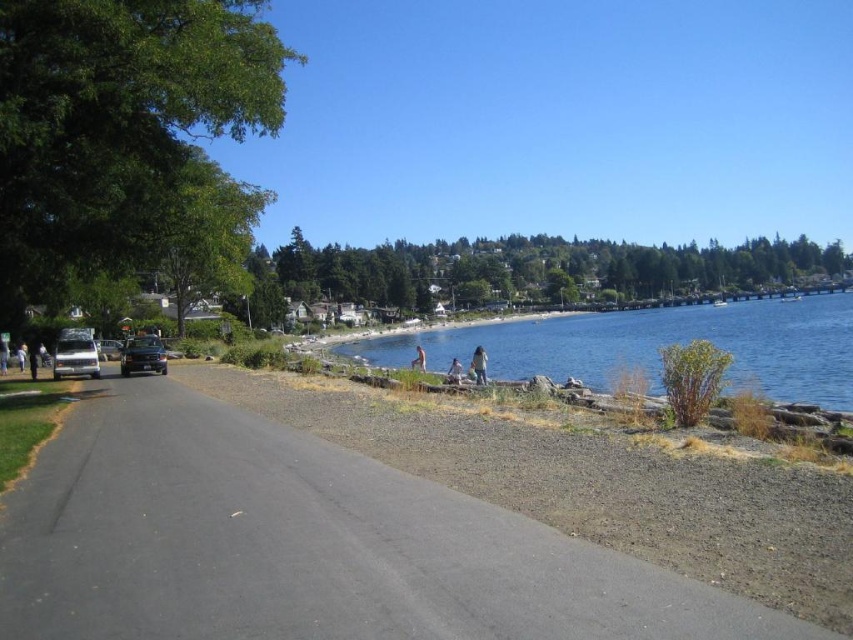
Question: Among these objects, which one is nearest to the camera?

Choices:
 (A) skinny nude person at center
 (B) light brown wooden bench at center
 (C) blue water at center
 (D) light blue shirt at left

Answer: (C)

Question: Is blue water at center above light brown fabric pants at center?

Choices:
 (A) yes
 (B) no

Answer: (A)

Question: Which of these objects is positioned farthest from the metallic silver car at left?

Choices:
 (A) silver metallic van at left
 (B) matte black person at left

Answer: (B)

Question: Which object is positioned farthest from the skinny nude person at center?

Choices:
 (A) silver metallic van at left
 (B) light blue shirt at left
 (C) metallic silver car at left
 (D) satin black car at left

Answer: (B)

Question: Is blue water at center above silver metallic van at left?

Choices:
 (A) no
 (B) yes

Answer: (B)

Question: Is silver metallic van at left wider than light blue shirt at left?

Choices:
 (A) no
 (B) yes

Answer: (B)